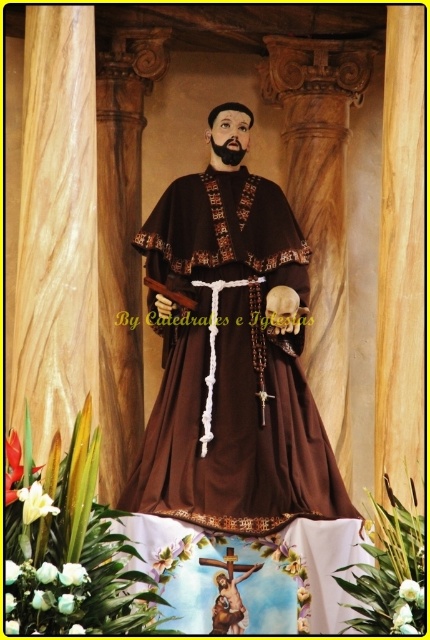
You are an art conservator examining the statue of the saint. You notice a specific point in the image at coordinates (230, 355). Based on the robe details, what object is located at this point?

The point at coordinates (230, 355) indicates the brown matte robe at center.

You are an art conservator examining the statue of the saint. You need to determine which object, the brown matte robe at center or the brown wooden skull at center, requires more space for preservation. Based on their sizes, which one should you prioritize?

The brown matte robe at center is larger in size than the brown wooden skull at center, so it requires more space for preservation and should be prioritized.